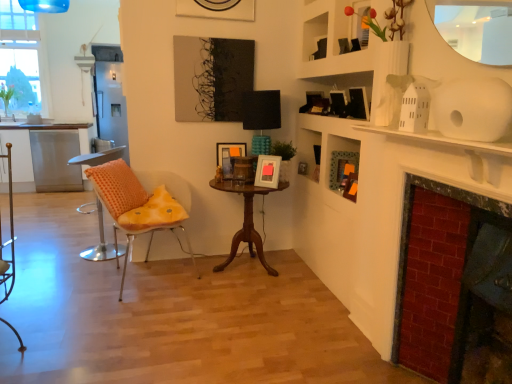
Question: From the image's perspective, is matte green frame at upper right located beneath orange fabric chair at left, which is the 1th chair in right-to-left order?

Choices:
 (A) yes
 (B) no

Answer: (B)

Question: Are matte green frame at upper right and orange fabric chair at left, the 2th chair positioned from the left, far apart?

Choices:
 (A) yes
 (B) no

Answer: (A)

Question: Is matte green frame at upper right located outside orange fabric chair at left, which is the 1th chair in right-to-left order?

Choices:
 (A) yes
 (B) no

Answer: (A)

Question: Is matte green frame at upper right facing away from orange fabric chair at left, the 2th chair positioned from the left?

Choices:
 (A) no
 (B) yes

Answer: (A)

Question: Does matte green frame at upper right come in front of orange fabric chair at left, which is the 1th chair in right-to-left order?

Choices:
 (A) no
 (B) yes

Answer: (A)

Question: Can you confirm if matte green frame at upper right is thinner than orange fabric chair at left, the 2th chair positioned from the left?

Choices:
 (A) no
 (B) yes

Answer: (B)

Question: From the image's perspective, is mahogany wood table at center over orange dotted pillow at left?

Choices:
 (A) yes
 (B) no

Answer: (B)

Question: Is mahogany wood table at center behind orange dotted pillow at left?

Choices:
 (A) no
 (B) yes

Answer: (B)

Question: Is mahogany wood table at center closer to the viewer compared to orange dotted pillow at left?

Choices:
 (A) no
 (B) yes

Answer: (A)

Question: Is mahogany wood table at center oriented away from orange dotted pillow at left?

Choices:
 (A) yes
 (B) no

Answer: (B)

Question: Is mahogany wood table at center smaller than orange dotted pillow at left?

Choices:
 (A) no
 (B) yes

Answer: (A)

Question: Considering the relative sizes of mahogany wood table at center and orange dotted pillow at left in the image provided, is mahogany wood table at center taller than orange dotted pillow at left?

Choices:
 (A) no
 (B) yes

Answer: (B)

Question: Would you say red brick fireplace at right contains metallic silver armchair at left?

Choices:
 (A) no
 (B) yes

Answer: (A)